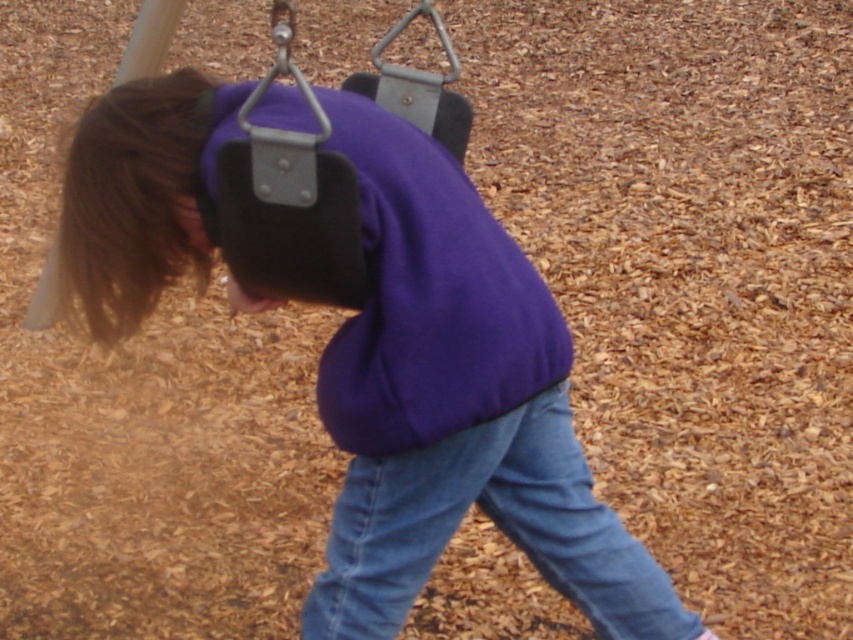
Which is in front, point (664, 604) or point (440, 74)?

Positioned in front is point (664, 604).

This screenshot has height=640, width=853. What are the coordinates of `denim at lower center` in the screenshot? It's located at (494, 524).

Who is more distant from viewer, (566, 451) or (47, 292)?

The point (47, 292) is behind.

At what (x,y) coordinates should I click in order to perform the action: click on denim at lower center. Please return your answer as a coordinate pair (x, y). The height and width of the screenshot is (640, 853). Looking at the image, I should click on (494, 524).

Is brown smooth hair at upper left above metallic swing at center?

Correct, brown smooth hair at upper left is located above metallic swing at center.

Is brown smooth hair at upper left below metallic swing at center?

Actually, brown smooth hair at upper left is above metallic swing at center.

Who is more distant from viewer, (111, 193) or (402, 106)?

The point (402, 106) is behind.

This screenshot has width=853, height=640. In order to click on brown smooth hair at upper left in this screenshot , I will do `click(132, 198)`.

This screenshot has height=640, width=853. I want to click on denim at lower center, so click(494, 524).

Based on the photo, who is shorter, denim at lower center or brown smooth hair at upper left?

With less height is brown smooth hair at upper left.

You are a GUI agent. You are given a task and a screenshot of the screen. Output one action in this format:
    pyautogui.click(x=<x>, y=<y>)
    Task: Click on the denim at lower center
    
    Given the screenshot: What is the action you would take?
    pyautogui.click(x=494, y=524)